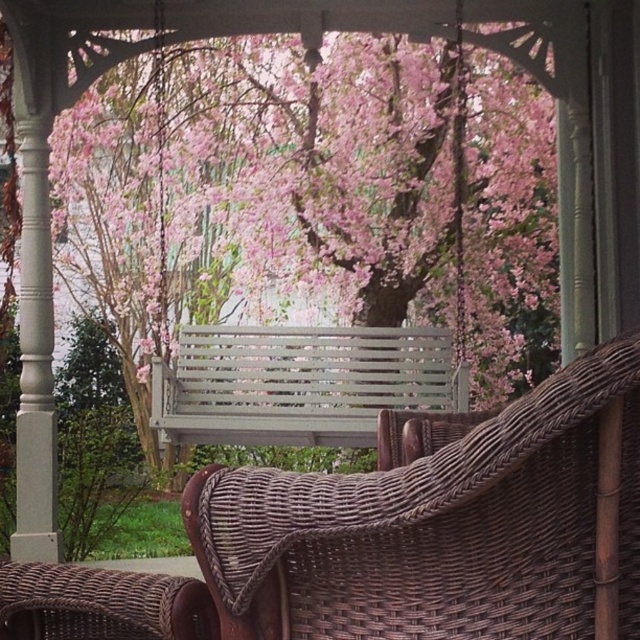
Question: Estimate the real-world distances between objects in this image. Which object is closer to the gray slatted bench at center?

Choices:
 (A) pink blossoms at center
 (B) brown wicker armchair at center

Answer: (A)

Question: Which object is farther from the camera taking this photo?

Choices:
 (A) gray slatted bench at center
 (B) pink blossoms at center

Answer: (B)

Question: Does pink blossoms at center have a lesser width compared to brown wicker armchair at center?

Choices:
 (A) yes
 (B) no

Answer: (B)

Question: Where is brown wicker armchair at center located in relation to gray slatted bench at center in the image?

Choices:
 (A) right
 (B) left

Answer: (A)

Question: Considering the relative positions of pink blossoms at center and gray slatted bench at center in the image provided, where is pink blossoms at center located with respect to gray slatted bench at center?

Choices:
 (A) above
 (B) below

Answer: (A)

Question: Among these objects, which one is farthest from the camera?

Choices:
 (A) pink blossoms at center
 (B) brown wicker armchair at center
 (C) gray slatted bench at center

Answer: (A)